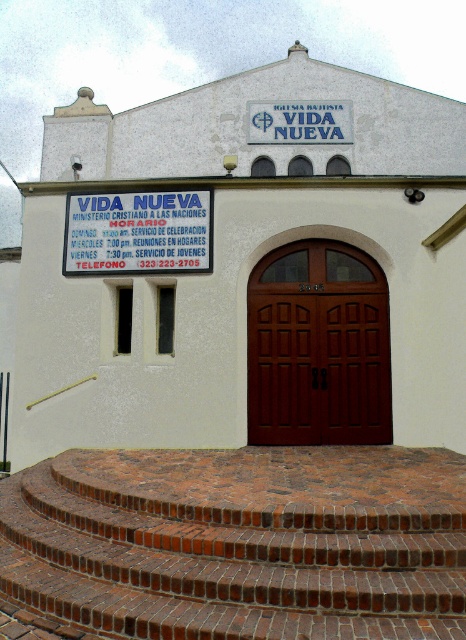
Can you confirm if brick stairs at center is bigger than mahogany wood door at center?

Yes.

Identify the location of brick stairs at center. The image size is (466, 640). (241, 541).

Between point (105, 584) and point (274, 378), which one is positioned behind?

The point (274, 378) is more distant.

Locate an element on the screen. The width and height of the screenshot is (466, 640). brick stairs at center is located at coordinates (241, 541).

Based on the photo, between white matte building at center and white plastic sign at center, which one has less height?

With less height is white plastic sign at center.

Describe the element at coordinates (242, 272) in the screenshot. I see `white matte building at center` at that location.

Who is more forward, (132, 193) or (182, 209)?

Point (182, 209) is in front.

You are a GUI agent. You are given a task and a screenshot of the screen. Output one action in this format:
    pyautogui.click(x=<x>, y=<y>)
    Task: Click on the white matte building at center
    The image size is (466, 640).
    Given the screenshot: What is the action you would take?
    pyautogui.click(x=242, y=272)

Is white matte building at center shorter than mahogany wood door at center?

In fact, white matte building at center may be taller than mahogany wood door at center.

Measure the distance between point (363, 96) and camera.

They are 21.00 meters apart.

Is point (303, 308) closer to viewer compared to point (313, 308)?

No.

The image size is (466, 640). I want to click on white matte building at center, so click(242, 272).